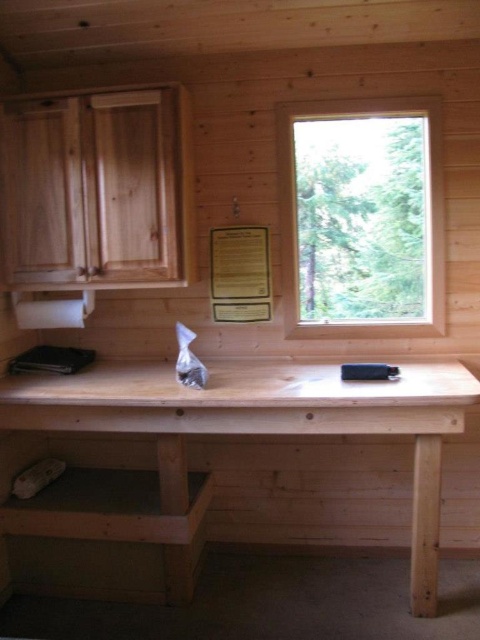
Can you confirm if natural wood table at center is thinner than clear glass window at upper right?

No, natural wood table at center is not thinner than clear glass window at upper right.

You are a GUI agent. You are given a task and a screenshot of the screen. Output one action in this format:
    pyautogui.click(x=<x>, y=<y>)
    Task: Click on the natural wood table at center
    The image size is (480, 640).
    Given the screenshot: What is the action you would take?
    pyautogui.click(x=264, y=420)